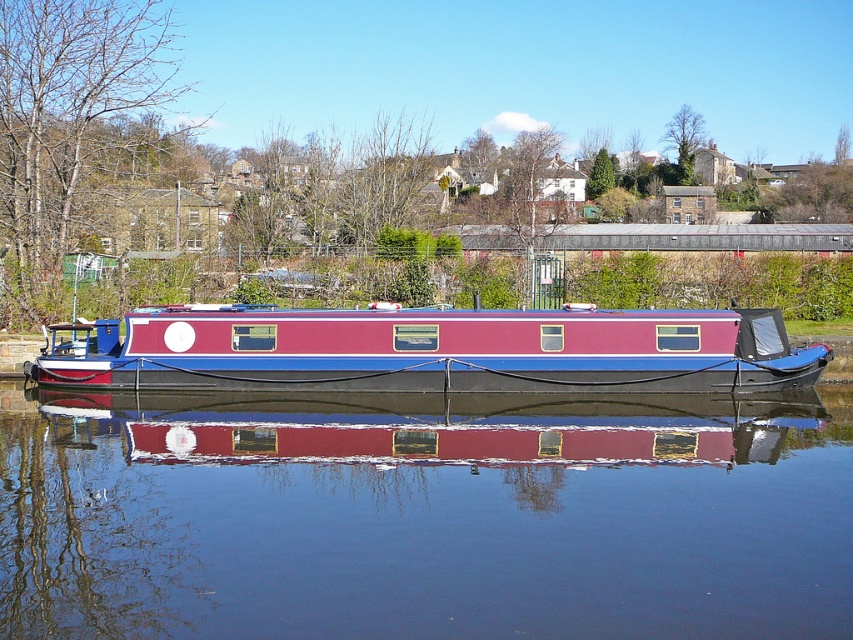
Question: Does glossy blue water at center come in front of matte red and blue boat at center?

Choices:
 (A) no
 (B) yes

Answer: (B)

Question: Among these objects, which one is nearest to the camera?

Choices:
 (A) glossy blue water at center
 (B) matte red and blue boat at center

Answer: (A)

Question: Observing the image, what is the correct spatial positioning of glossy blue water at center in reference to matte red and blue boat at center?

Choices:
 (A) above
 (B) below

Answer: (B)

Question: Among these points, which one is farthest from the camera?

Choices:
 (A) (405, 317)
 (B) (122, 608)

Answer: (A)

Question: Is glossy blue water at center to the right of matte red and blue boat at center from the viewer's perspective?

Choices:
 (A) no
 (B) yes

Answer: (B)